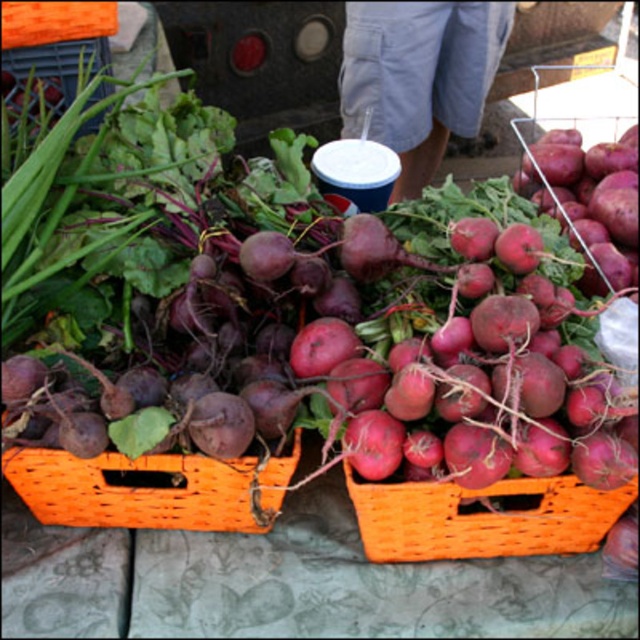
Is matte purple beetroot at center closer to camera compared to orange woven basket at center?

Yes, it is.

Between point (340, 269) and point (244, 477), which one is positioned in front?

Positioned in front is point (244, 477).

Describe the element at coordinates (337, 356) in the screenshot. The height and width of the screenshot is (640, 640). I see `matte purple beetroot at center` at that location.

The image size is (640, 640). I want to click on matte purple beetroot at center, so click(x=337, y=356).

The image size is (640, 640). Describe the element at coordinates (337, 356) in the screenshot. I see `matte purple beetroot at center` at that location.

Does matte purple beetroot at center appear on the left side of orange wicker basket at center?

Yes, matte purple beetroot at center is to the left of orange wicker basket at center.

Is point (333, 348) closer to camera compared to point (596, 512)?

No, (333, 348) is further to viewer.

Where is `matte purple beetroot at center`? The width and height of the screenshot is (640, 640). matte purple beetroot at center is located at coordinates (337, 356).

Is point (509, 512) closer to viewer compared to point (205, 470)?

No.

Can you confirm if orange wicker basket at center is positioned to the right of orange woven basket at center?

Yes, orange wicker basket at center is to the right of orange woven basket at center.

The image size is (640, 640). Describe the element at coordinates (483, 516) in the screenshot. I see `orange wicker basket at center` at that location.

The width and height of the screenshot is (640, 640). I want to click on orange wicker basket at center, so click(x=483, y=516).